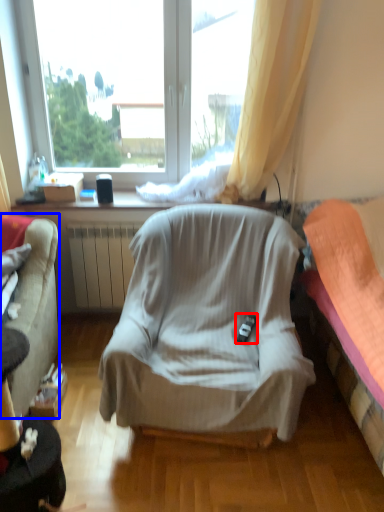
Question: Which object is closer to the camera taking this photo, remote control (highlighted by a red box) or studio couch (highlighted by a blue box)?

Choices:
 (A) remote control
 (B) studio couch

Answer: (B)